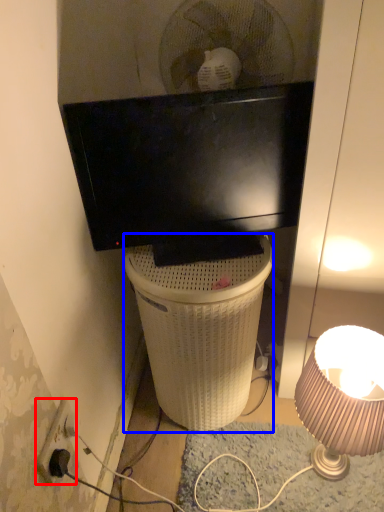
Question: Among these objects, which one is nearest to the camera, power outlet (highlighted by a red box) or trash bin/can (highlighted by a blue box)?

Choices:
 (A) power outlet
 (B) trash bin/can

Answer: (A)